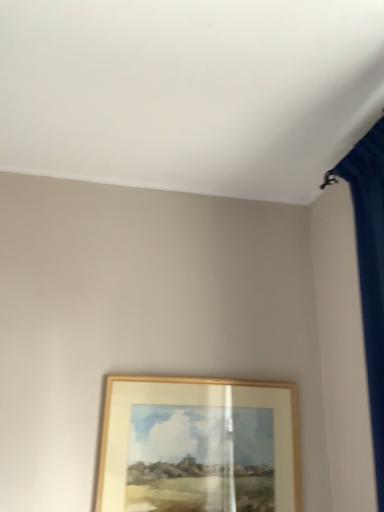
In order to face gold wooden picture frame at lower center, should I rotate leftwards or rightwards?

Rotate right and turn 1.403 degrees.

You are a GUI agent. You are given a task and a screenshot of the screen. Output one action in this format:
    pyautogui.click(x=<x>, y=<y>)
    Task: Click on the gold wooden picture frame at lower center
    
    Given the screenshot: What is the action you would take?
    pyautogui.click(x=198, y=446)

The image size is (384, 512). Describe the element at coordinates (198, 446) in the screenshot. I see `gold wooden picture frame at lower center` at that location.

What is the approximate width of gold wooden picture frame at lower center?

It is 2.02 inches.

I want to click on gold wooden picture frame at lower center, so click(x=198, y=446).